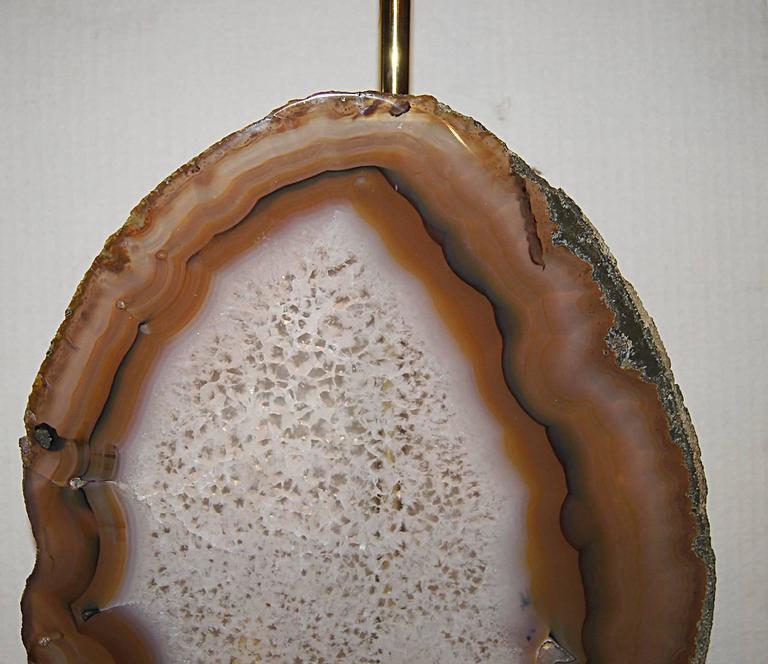
Where is `rod`? This screenshot has width=768, height=664. rod is located at coordinates (395, 33).